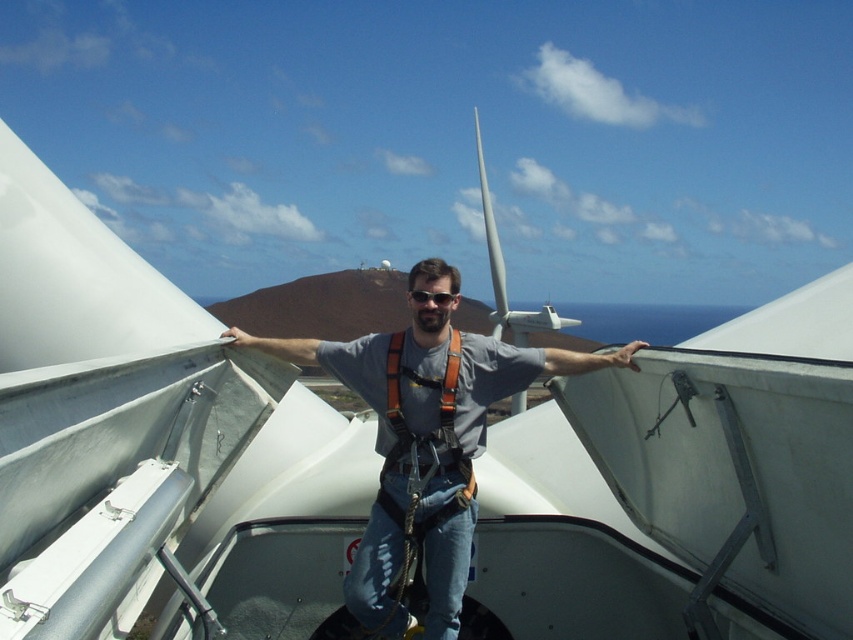
Question: Estimate the real-world distances between objects in this image. Which object is farther from the gray fabric construction worker at center?

Choices:
 (A) black plastic goggles at center
 (B) orange fabric safety vest at center

Answer: (A)

Question: From the image, what is the correct spatial relationship of orange fabric safety vest at center in relation to black plastic goggles at center?

Choices:
 (A) below
 (B) above

Answer: (A)

Question: Does orange fabric safety vest at center have a lesser width compared to black plastic goggles at center?

Choices:
 (A) yes
 (B) no

Answer: (B)

Question: Considering the real-world distances, which object is farthest from the black plastic goggles at center?

Choices:
 (A) gray fabric construction worker at center
 (B) orange fabric safety vest at center

Answer: (A)

Question: Can you confirm if orange fabric safety vest at center is smaller than black plastic goggles at center?

Choices:
 (A) no
 (B) yes

Answer: (A)

Question: Which point appears farthest from the camera in this image?

Choices:
 (A) (410, 280)
 (B) (428, 291)

Answer: (A)